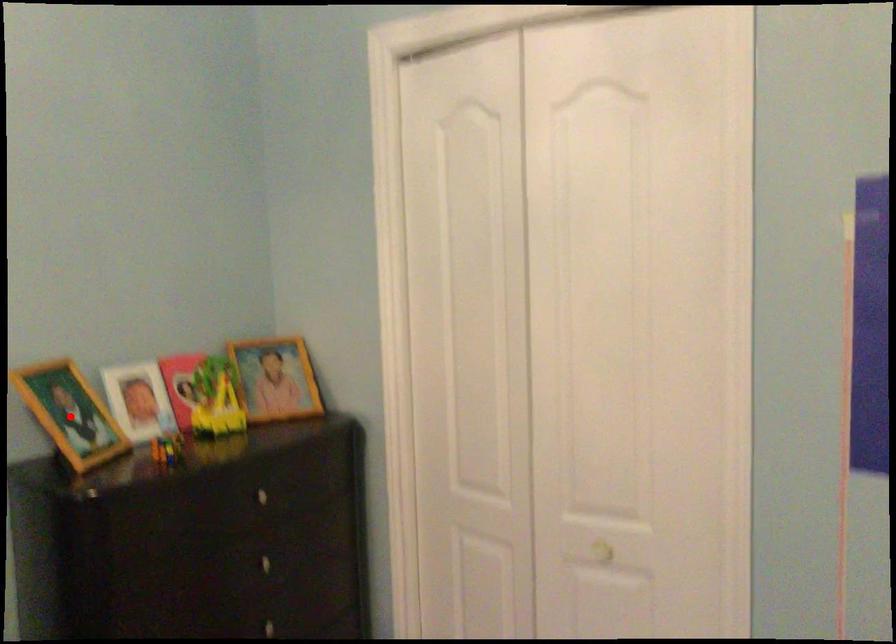
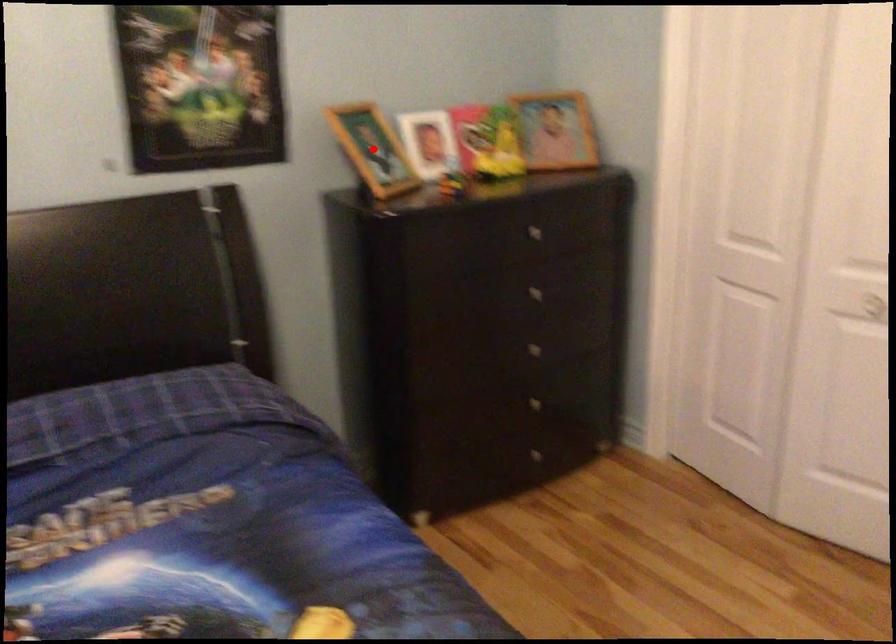
I am providing you with two images of the same scene from different viewpoints. A red point is marked on the first image and another point is marked on the second image. Is the marked point in image1 the same physical position as the marked point in image2?

Yes